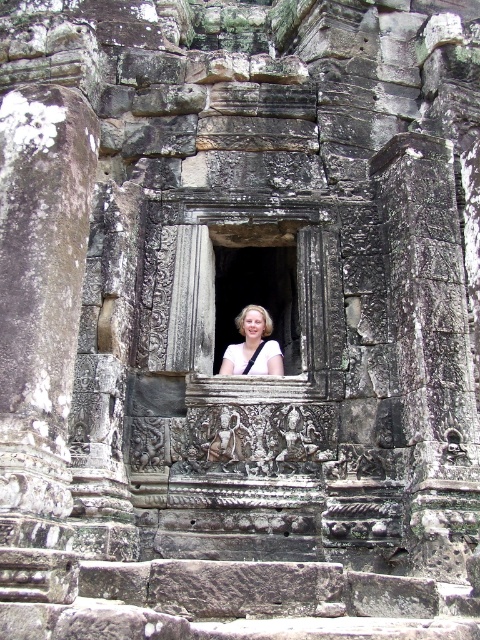
Is point (215, 228) farther from viewer compared to point (250, 349)?

That is False.

Which is in front, point (228, 339) or point (268, 348)?

Point (268, 348) is in front.

Which is in front, point (276, 291) or point (239, 314)?

Point (276, 291) is in front.

Locate an element on the screen. transparent glass window at center is located at coordinates (256, 282).